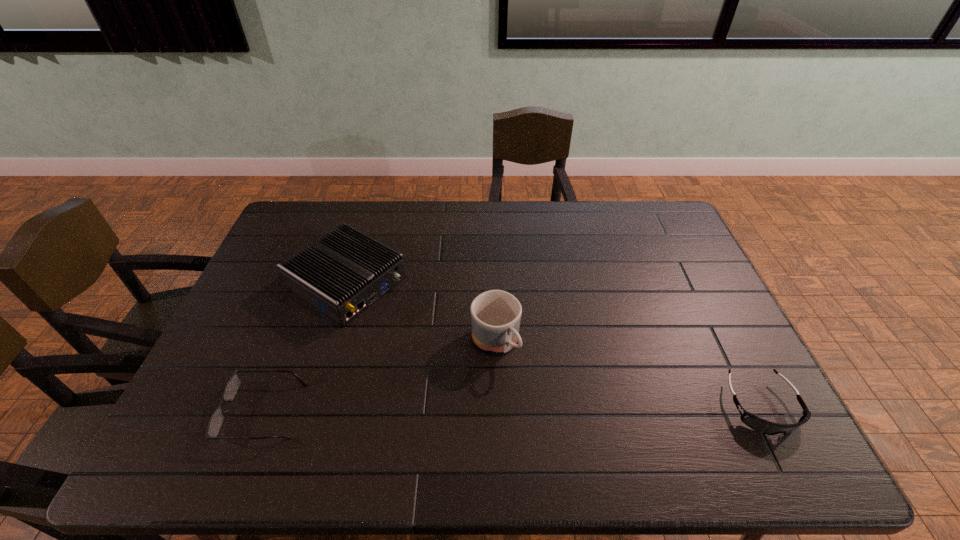
Where is `vacant point located on the back panel of the router`? Image resolution: width=960 pixels, height=540 pixels. vacant point located on the back panel of the router is located at coordinates (435, 337).

The height and width of the screenshot is (540, 960). I want to click on vacant area located on the side with the handle of the tallest object, so click(x=522, y=381).

Where is `spectacles that is at the near edge`? The width and height of the screenshot is (960, 540). spectacles that is at the near edge is located at coordinates (232, 386).

Where is `goggles that is at the near edge`? goggles that is at the near edge is located at coordinates (758, 424).

Locate an element on the screen. The height and width of the screenshot is (540, 960). spectacles that is at the left edge is located at coordinates (232, 386).

The image size is (960, 540). In order to click on router that is at the left edge in this screenshot , I will do `click(341, 274)`.

Image resolution: width=960 pixels, height=540 pixels. Find the location of `object that is at the right edge`. object that is at the right edge is located at coordinates (758, 424).

Locate an element on the screen. This screenshot has height=540, width=960. object that is positioned at the near left corner is located at coordinates (232, 386).

Locate an element on the screen. This screenshot has height=540, width=960. object at the near right corner is located at coordinates (758, 424).

In the image, there is a desktop. In order to click on vacant space at the far edge in this screenshot , I will do `click(356, 201)`.